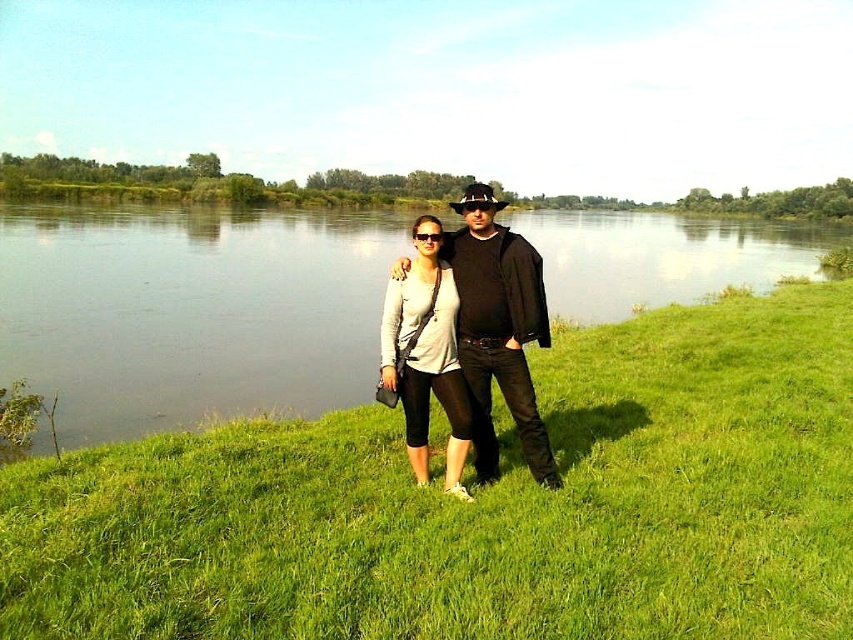
Question: Is green grassy at center in front of matte black jacket at center?

Choices:
 (A) no
 (B) yes

Answer: (B)

Question: Which object is positioned closest to the matte white shirt at center?

Choices:
 (A) transparent plastic goggles at center
 (B) green grass at lower center
 (C) green grassy at center
 (D) matte black jacket at center

Answer: (A)

Question: Which point is farther to the camera?

Choices:
 (A) (251, 236)
 (B) (436, 230)

Answer: (A)

Question: Does matte white shirt at center have a lesser width compared to transparent plastic goggles at center?

Choices:
 (A) yes
 (B) no

Answer: (A)

Question: Based on their relative distances, which object is nearer to the green grassy at center?

Choices:
 (A) green grass at lower center
 (B) matte white shirt at center
 (C) transparent plastic goggles at center
 (D) matte black jacket at center

Answer: (D)

Question: Is matte black jacket at center further to the viewer compared to matte white shirt at center?

Choices:
 (A) no
 (B) yes

Answer: (A)